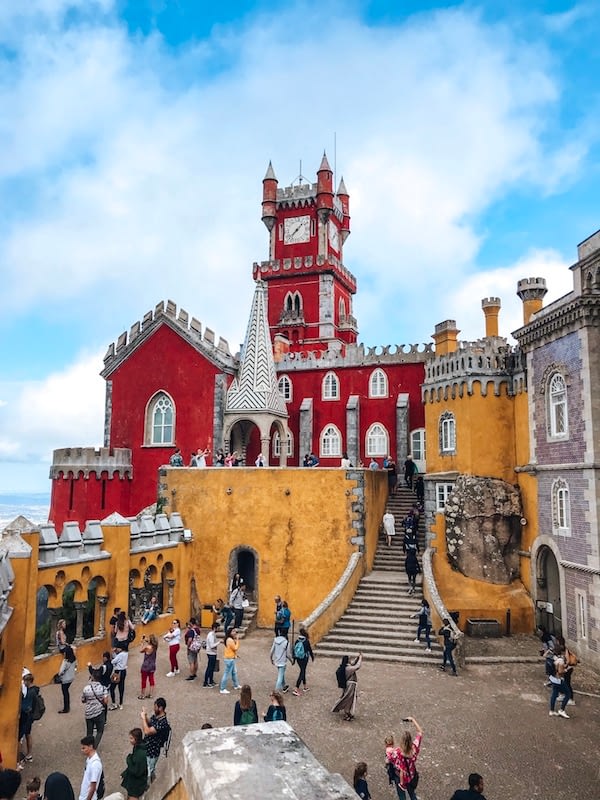
You are a GUI agent. You are given a task and a screenshot of the screen. Output one action in this format:
    pyautogui.click(x=<x>, y=<y>)
    Task: Click on the door
    
    Given the screenshot: What is the action you would take?
    [551, 578]